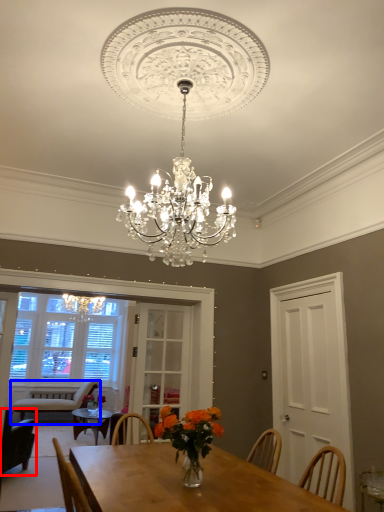
Question: Among these objects, which one is farthest to the camera, chair (highlighted by a red box) or chair (highlighted by a blue box)?

Choices:
 (A) chair
 (B) chair

Answer: (B)